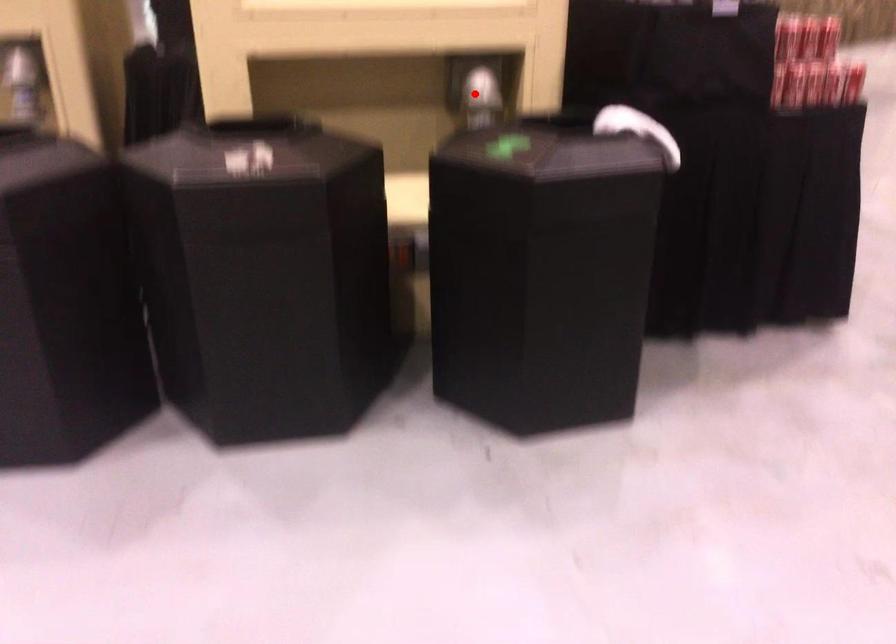
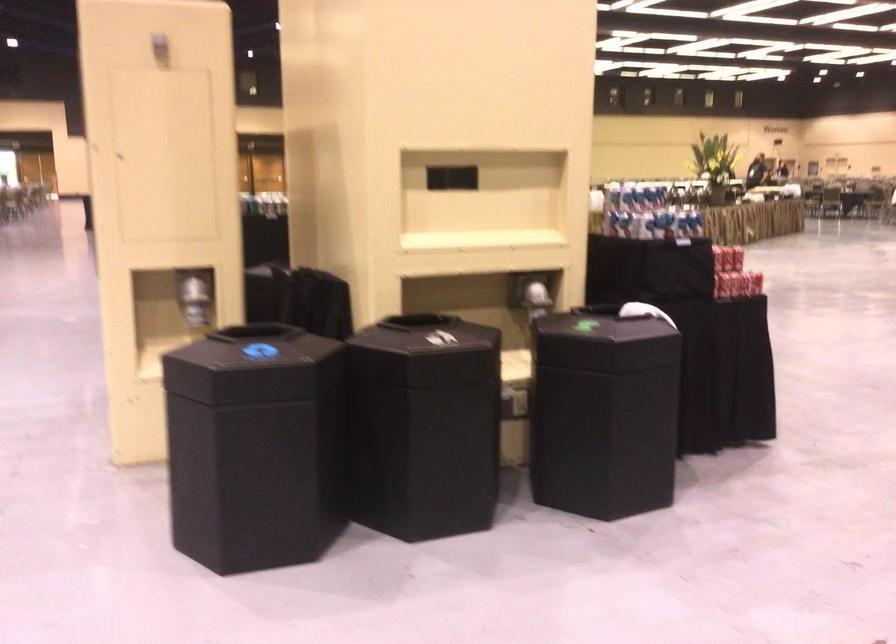
The point at the highlighted location is marked in the first image. Where is the corresponding point in the second image?

(536, 299)